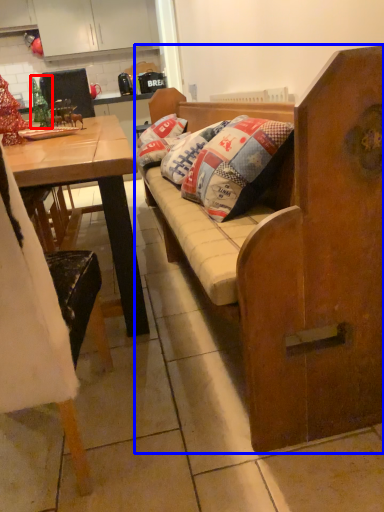
Question: Which object appears farthest to the camera in this image, christmas decoration (highlighted by a red box) or studio couch (highlighted by a blue box)?

Choices:
 (A) christmas decoration
 (B) studio couch

Answer: (A)